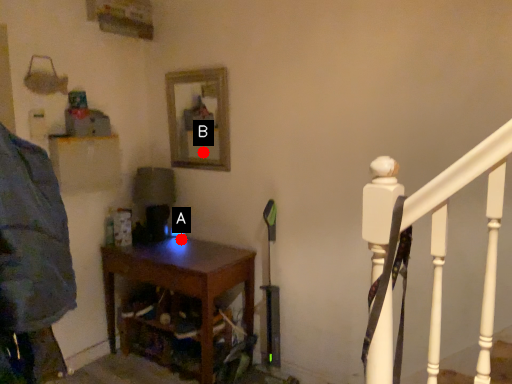
Question: Two points are circled on the image, labeled by A and B beside each circle. Which point appears farthest from the camera in this image?

Choices:
 (A) A is further
 (B) B is further

Answer: (B)